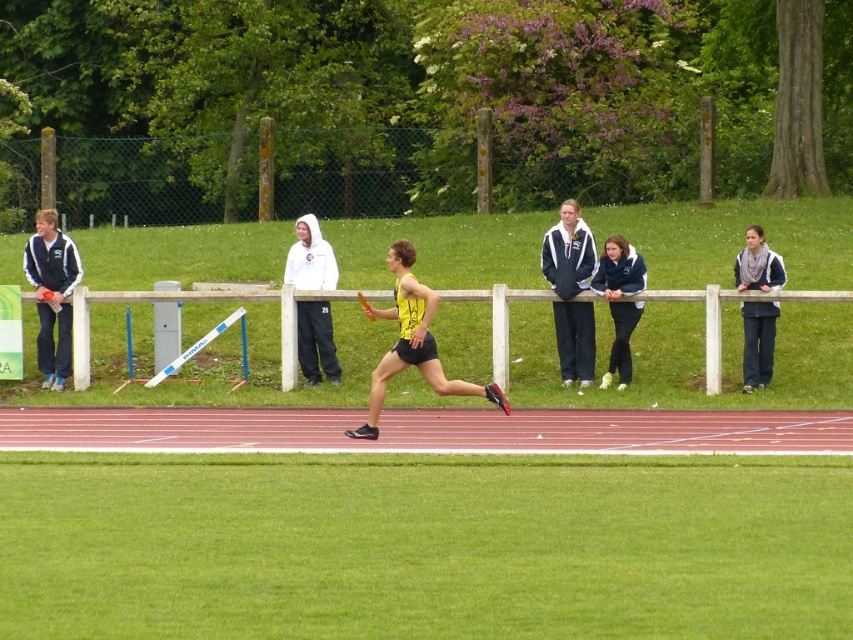
Question: Is green fleece jacket at left above dark blue sweater at right?

Choices:
 (A) yes
 (B) no

Answer: (A)

Question: Which point is closer to the camera taking this photo?

Choices:
 (A) tap(776, 262)
 (B) tap(434, 349)

Answer: (B)

Question: Is green fleece jacket at left in front of dark blue jacket at center?

Choices:
 (A) no
 (B) yes

Answer: (A)

Question: Considering the relative positions of green fleece jacket at left and dark blue jacket at center in the image provided, where is green fleece jacket at left located with respect to dark blue jacket at center?

Choices:
 (A) below
 (B) above

Answer: (B)

Question: Based on their relative distances, which object is farther from the white fleece jacket at center?

Choices:
 (A) dark blue sweater at right
 (B) white fleece hoodie at upper center
 (C) green fleece jacket at left
 (D) yellow/black athletic uniform at center

Answer: (C)

Question: Which object appears closest to the camera in this image?

Choices:
 (A) white fleece jacket at center
 (B) dark blue jacket at center

Answer: (B)